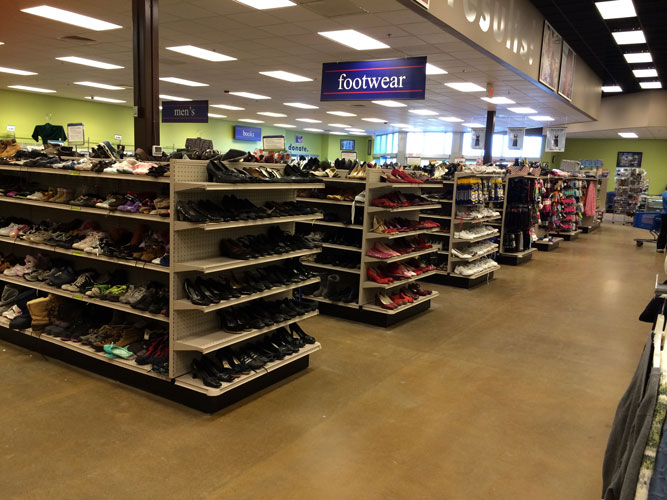
You are a GUI agent. You are given a task and a screenshot of the screen. Output one action in this format:
    pyautogui.click(x=<x>, y=<y>)
    Task: Click on the lights
    
    Given the screenshot: What is the action you would take?
    pyautogui.click(x=348, y=44), pyautogui.click(x=281, y=1)